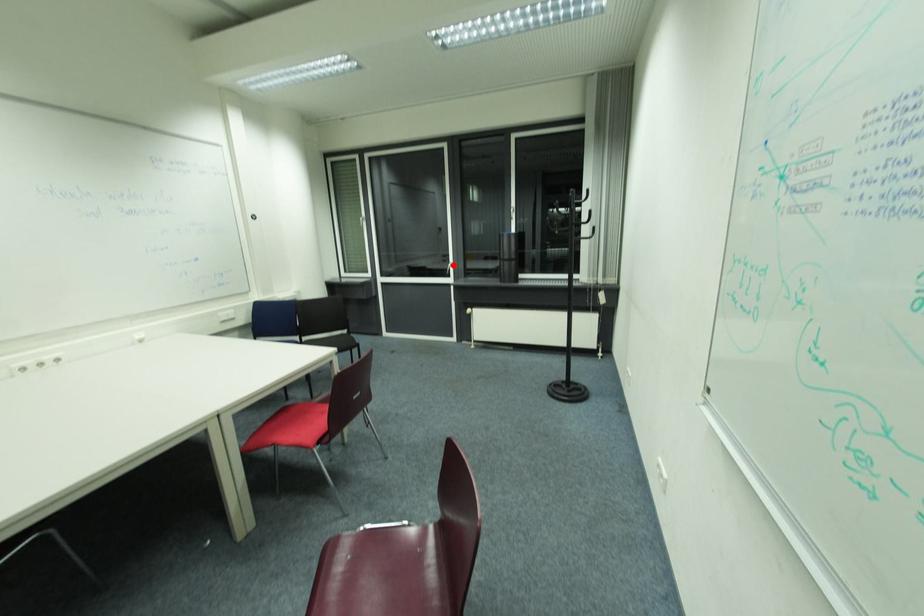
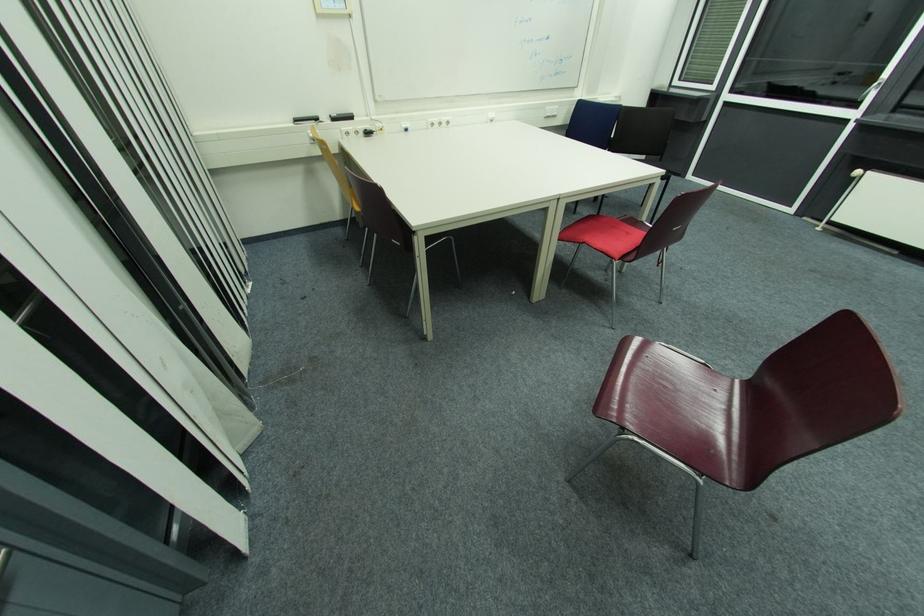
Question: I am providing you with two images of the same scene from different viewpoints. A red point is marked on the first image. Can you still see the location of the red point in image 2?

Choices:
 (A) Yes
 (B) No

Answer: (A)